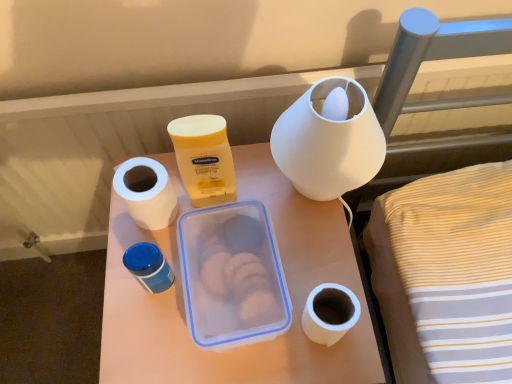
Question: From their relative heights in the image, would you say white plastic container at center is taller or shorter than white matte paper towel at left?

Choices:
 (A) short
 (B) tall

Answer: (B)

Question: From the image's perspective, is white plastic container at center located above or below white matte paper towel at left?

Choices:
 (A) below
 (B) above

Answer: (A)

Question: Which object is the closest to the white matte paper towel at left?

Choices:
 (A) white matte toilet paper at lower right
 (B) yellow matte lotion at center
 (C) white matte lampshade at upper center, arranged as the 1th pottery when viewed from the right
 (D) white plastic container at center
 (E) blue plastic container at center-left, which is counted as the first pottery, starting from the left

Answer: (B)

Question: Based on their relative distances, which object is farther from the white matte lampshade at upper center, which is counted as the 2th pottery, starting from the bottom?

Choices:
 (A) yellow matte lotion at center
 (B) white matte toilet paper at lower right
 (C) white matte paper towel at left
 (D) white plastic container at center
 (E) blue plastic container at center-left, the second pottery viewed from the top

Answer: (E)